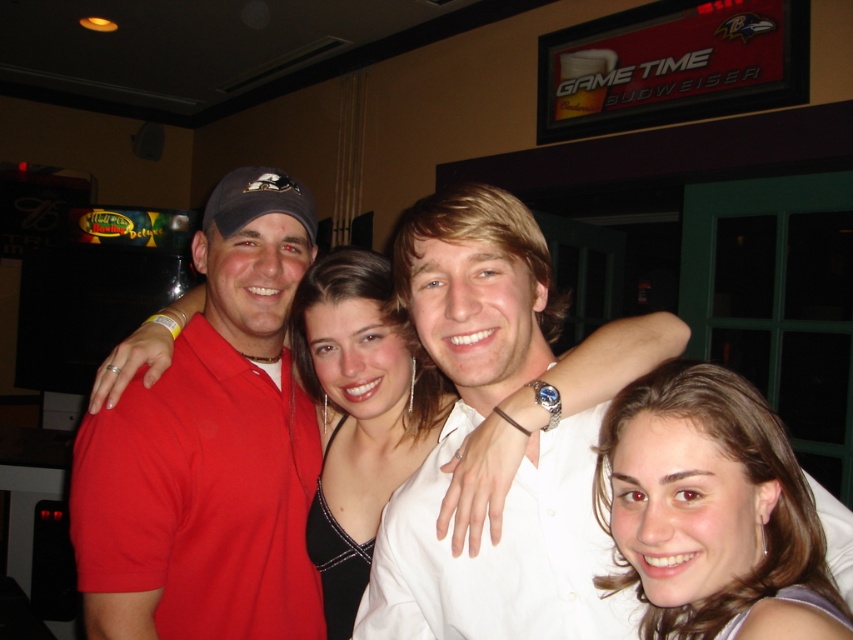
Which of these two, brown hair at center or satin black dress at center, stands shorter?

→ brown hair at center

Which is behind, point (668, 387) or point (318, 474)?

The point (318, 474) is behind.

I want to click on brown hair at center, so click(x=712, y=512).

Which is more to the right, matte red polo shirt at center or white smooth shirt at center?

white smooth shirt at center

Can you confirm if matte red polo shirt at center is positioned to the left of white smooth shirt at center?

Indeed, matte red polo shirt at center is positioned on the left side of white smooth shirt at center.

Who is more distant from viewer, (x=253, y=353) or (x=627, y=621)?

Point (x=253, y=353)

Where is `matte red polo shirt at center`? matte red polo shirt at center is located at coordinates [210, 449].

Describe the element at coordinates (476, 428) in the screenshot. I see `white smooth shirt at center` at that location.

Locate an element on the screen. The height and width of the screenshot is (640, 853). white smooth shirt at center is located at coordinates (476, 428).